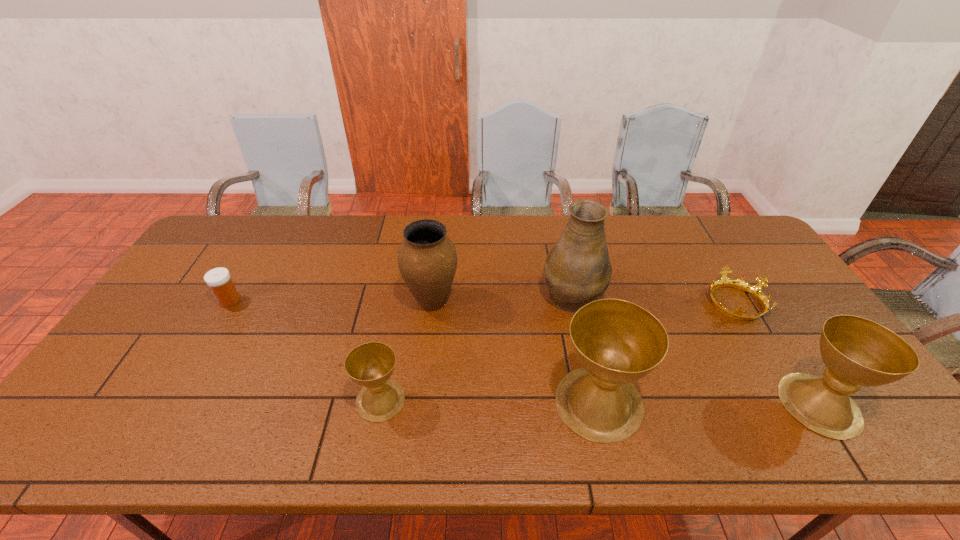
The height and width of the screenshot is (540, 960). I want to click on crown that is positioned at the right edge, so click(x=754, y=290).

You are a GUI agent. You are given a task and a screenshot of the screen. Output one action in this format:
    pyautogui.click(x=<x>, y=<y>)
    Task: Click on the object situated at the near right corner
    
    Given the screenshot: What is the action you would take?
    pyautogui.click(x=857, y=352)

Identify the location of vacant region at the far edge of the desktop. This screenshot has height=540, width=960. (460, 252).

In the image, there is a desktop. In order to click on vacant area at the near edge in this screenshot , I will do `click(545, 388)`.

Image resolution: width=960 pixels, height=540 pixels. What are the coordinates of `free space at the right edge` in the screenshot? It's located at (783, 287).

Where is `free space between the crown and the medicine`? This screenshot has width=960, height=540. free space between the crown and the medicine is located at coordinates (482, 301).

Locate an element on the screen. vacant area between the second chalice from left to right and the fourth shortest object is located at coordinates (709, 403).

Locate an element on the screen. free area in between the medicine and the shortest chalice is located at coordinates (305, 350).

I want to click on free space between the medicine and the urn, so click(x=330, y=301).

This screenshot has width=960, height=540. Identify the location of free space between the leftmost object and the crown. (482, 301).